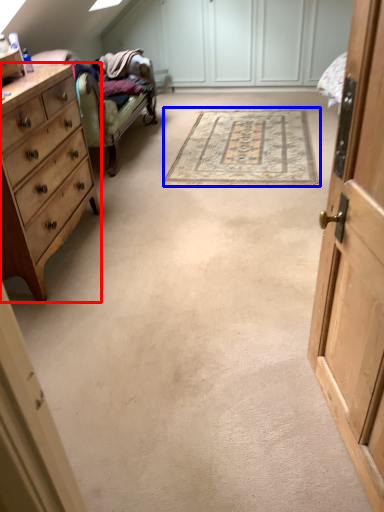
Question: Which of the following is the farthest to the observer, chest of drawers (highlighted by a red box) or mat (highlighted by a blue box)?

Choices:
 (A) chest of drawers
 (B) mat

Answer: (B)